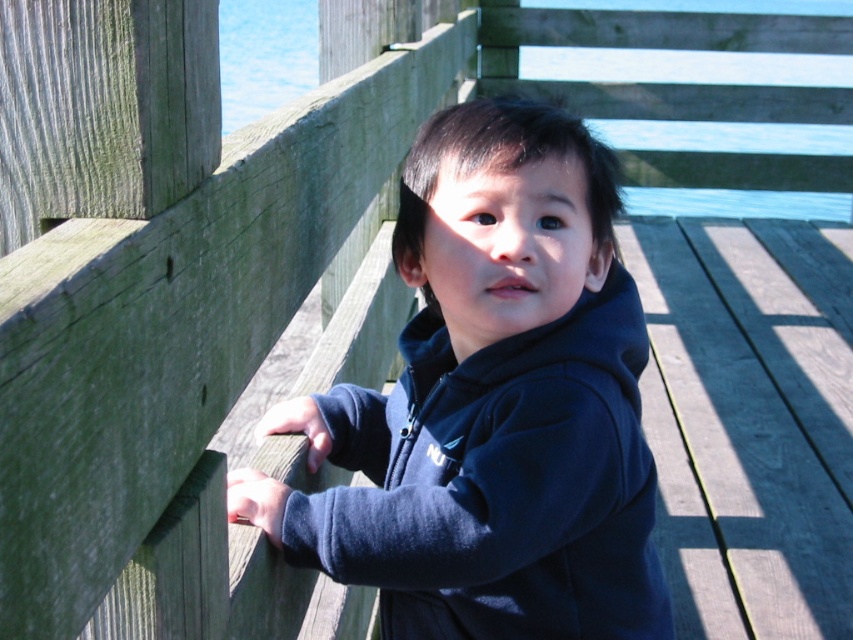
Question: Among these points, which one is farthest from the camera?

Choices:
 (A) (251, 483)
 (B) (824, 1)
 (C) (403, 392)
 (D) (311, 397)

Answer: (B)

Question: Is blue water at upper left thinner than brown wood hand at left?

Choices:
 (A) no
 (B) yes

Answer: (A)

Question: Which point appears farthest from the camera in this image?

Choices:
 (A) (285, 410)
 (B) (578, 456)
 (C) (228, 509)

Answer: (A)

Question: Does dark blue fleece at center appear on the left side of brown wood hand at left?

Choices:
 (A) no
 (B) yes

Answer: (A)

Question: Is blue water at upper left positioned behind matte black hand at center?

Choices:
 (A) yes
 (B) no

Answer: (A)

Question: Considering the real-world distances, which object is closest to the brown wood hand at left?

Choices:
 (A) blue water at upper left
 (B) dark blue fleece at center
 (C) matte black hand at center

Answer: (C)